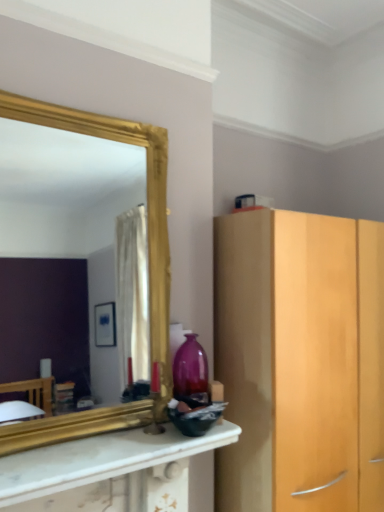
Question: Does white marble countertop at center have a lesser height compared to gold-framed mirror at upper left?

Choices:
 (A) yes
 (B) no

Answer: (A)

Question: Would you say white marble countertop at center is a long distance from gold-framed mirror at upper left?

Choices:
 (A) no
 (B) yes

Answer: (B)

Question: Considering the relative sizes of white marble countertop at center and gold-framed mirror at upper left in the image provided, is white marble countertop at center taller than gold-framed mirror at upper left?

Choices:
 (A) no
 (B) yes

Answer: (A)

Question: Is the depth of white marble countertop at center less than that of gold-framed mirror at upper left?

Choices:
 (A) yes
 (B) no

Answer: (A)

Question: Is white marble countertop at center behind gold-framed mirror at upper left?

Choices:
 (A) no
 (B) yes

Answer: (A)

Question: Is white marble countertop at center not within gold-framed mirror at upper left?

Choices:
 (A) yes
 (B) no

Answer: (A)

Question: Is matte purple glass vase at center not inside gold-framed mirror at upper left?

Choices:
 (A) no
 (B) yes

Answer: (B)

Question: Is matte purple glass vase at center far away from gold-framed mirror at upper left?

Choices:
 (A) yes
 (B) no

Answer: (A)

Question: From the image's perspective, does matte purple glass vase at center appear higher than gold-framed mirror at upper left?

Choices:
 (A) no
 (B) yes

Answer: (A)

Question: From a real-world perspective, is matte purple glass vase at center on gold-framed mirror at upper left?

Choices:
 (A) no
 (B) yes

Answer: (A)

Question: Can you confirm if matte purple glass vase at center is wider than gold-framed mirror at upper left?

Choices:
 (A) no
 (B) yes

Answer: (A)

Question: Is gold-framed mirror at upper left at the back of matte purple glass vase at center?

Choices:
 (A) yes
 (B) no

Answer: (B)

Question: Can we say gold-framed mirror at upper left lies outside white marble countertop at center?

Choices:
 (A) yes
 (B) no

Answer: (A)